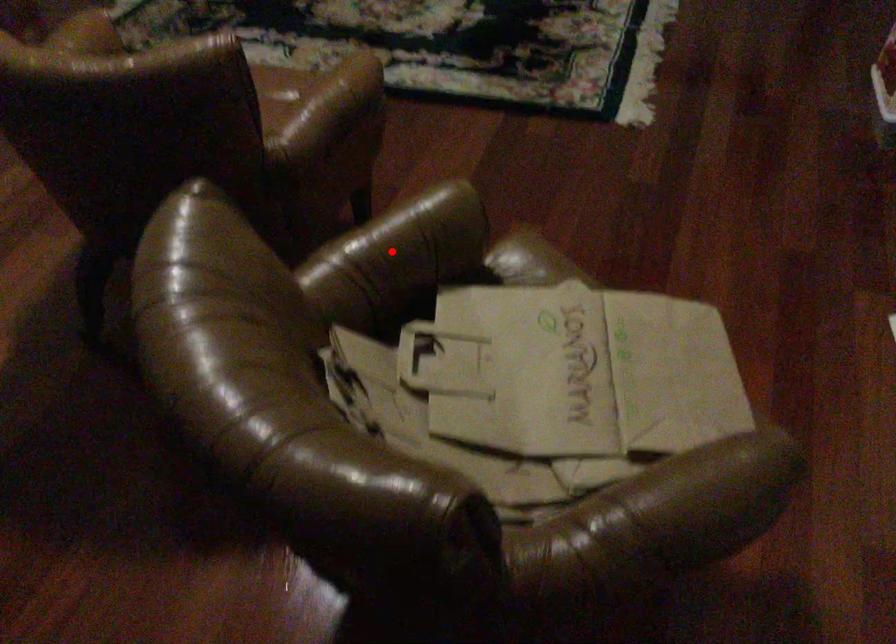
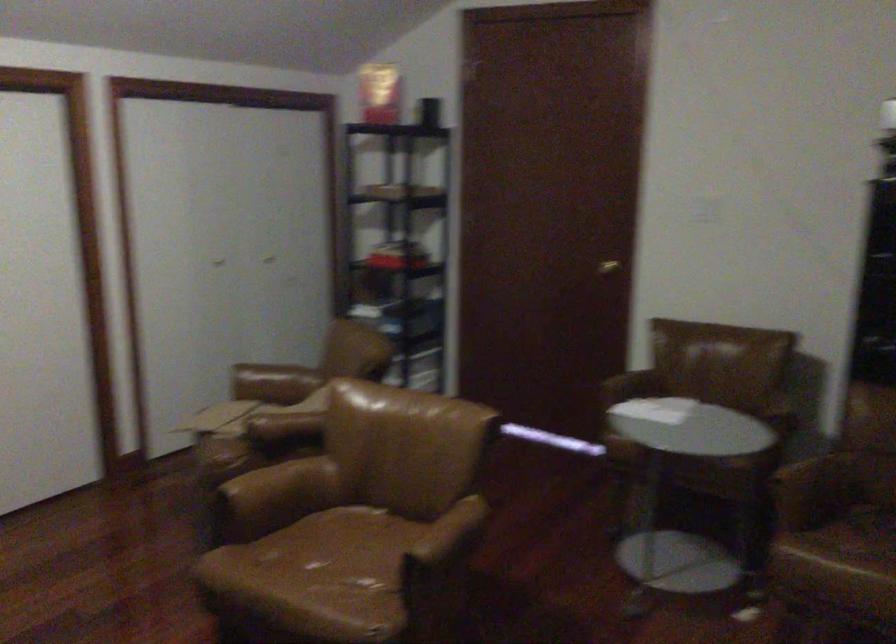
The point at the highlighted location is marked in the first image. Where is the corresponding point in the second image?

(283, 426)